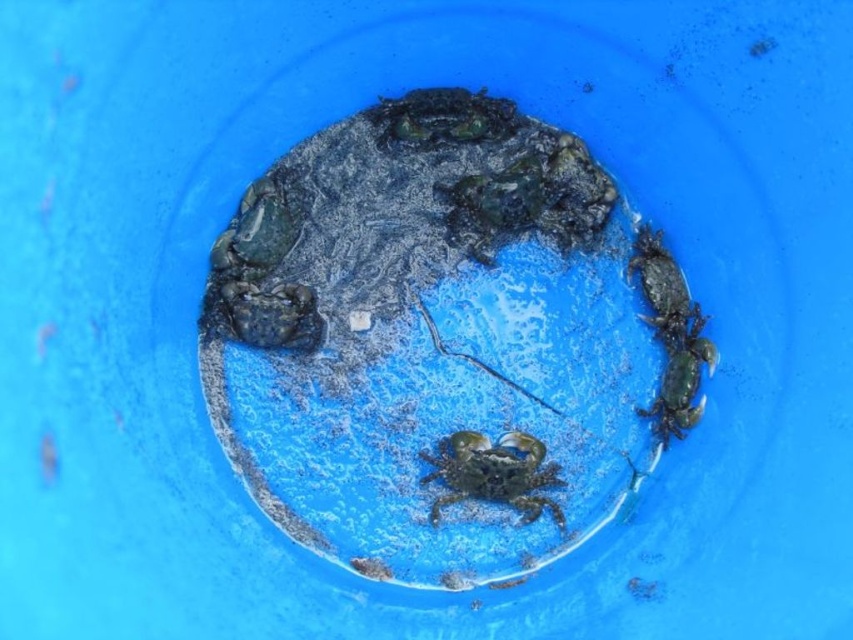
You are a marine biologist observing the crabs in the blue plastic container. You notice two crabs, the green matte crab at right and the green matte crab at center. Which crab is positioned higher in the container?

The green matte crab at right is located above the green matte crab at center, so it is positioned higher in the container.

You are a marine biologist observing the blue plastic container. You need to identify which crab is bigger between the green matte crab at right and the green matte crab at center. Which one is larger?

The green matte crab at right is larger compared to the green matte crab at center, so the green matte crab at right is the bigger one.

You are a marine biologist observing the crabs in the blue plastic container. You notice two crabs, the green matte crab at right and the green matte crab at center. Which crab appears closer to you based on their positions?

The green matte crab at right appears closer because it is positioned in front of the green matte crab at center.